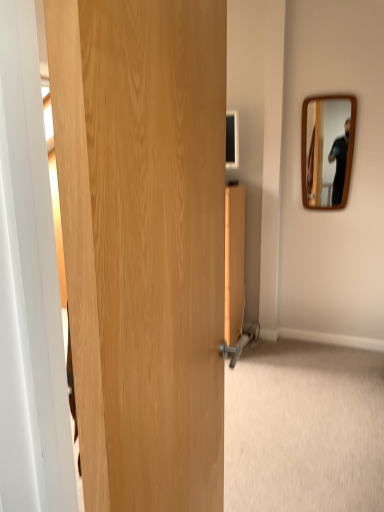
The image size is (384, 512). What do you see at coordinates (327, 150) in the screenshot? I see `wooden mirror at upper right` at bounding box center [327, 150].

The image size is (384, 512). I want to click on wooden mirror at upper right, so click(x=327, y=150).

Find the location of a particular element. natural wood door at center is located at coordinates (143, 243).

Measure the distance between natural wood door at center and camera.

The distance of natural wood door at center from camera is 17.34 inches.

Image resolution: width=384 pixels, height=512 pixels. Describe the element at coordinates (143, 243) in the screenshot. I see `natural wood door at center` at that location.

Where is `wooden mirror at upper right`? wooden mirror at upper right is located at coordinates (327, 150).

Which is more to the right, wooden mirror at upper right or natural wood door at center?

Positioned to the right is wooden mirror at upper right.

In the image, is wooden mirror at upper right positioned in front of or behind natural wood door at center?

Clearly, wooden mirror at upper right is behind natural wood door at center.

Considering the points (323, 202) and (148, 470), which point is in front, point (323, 202) or point (148, 470)?

Positioned in front is point (148, 470).

From the image's perspective, is wooden mirror at upper right located above or below natural wood door at center?

From the image's perspective, wooden mirror at upper right appears above natural wood door at center.

From a real-world perspective, does wooden mirror at upper right sit lower than natural wood door at center?

No, from a real-world perspective, wooden mirror at upper right is not below natural wood door at center.

Between wooden mirror at upper right and natural wood door at center, which one has smaller width?

Thinner between the two is wooden mirror at upper right.

Considering the sizes of objects wooden mirror at upper right and natural wood door at center in the image provided, who is shorter, wooden mirror at upper right or natural wood door at center?

wooden mirror at upper right.

Considering the sizes of objects wooden mirror at upper right and natural wood door at center in the image provided, who is bigger, wooden mirror at upper right or natural wood door at center?

With larger size is natural wood door at center.

Is natural wood door at center surrounded by wooden mirror at upper right?

No, natural wood door at center is not a part of wooden mirror at upper right.

Is wooden mirror at upper right not near natural wood door at center?

Yes, wooden mirror at upper right and natural wood door at center are quite far apart.

Is wooden mirror at upper right oriented away from natural wood door at center?

wooden mirror at upper right is not turned away from natural wood door at center.

The width and height of the screenshot is (384, 512). Identify the location of mirror that appears above the natural wood door at center (from the image's perspective). (327, 150).

Which object is positioned more to the left, natural wood door at center or wooden mirror at upper right?

natural wood door at center.

Is the depth of natural wood door at center greater than that of wooden mirror at upper right?

No, natural wood door at center is closer to the camera.

Is point (115, 28) closer to camera compared to point (302, 149)?

Yes, it is.

From the image's perspective, is natural wood door at center over wooden mirror at upper right?

Actually, natural wood door at center appears below wooden mirror at upper right in the image.

From a real-world perspective, which is physically above, natural wood door at center or wooden mirror at upper right?

wooden mirror at upper right, from a real-world perspective.

Can you confirm if natural wood door at center is wider than wooden mirror at upper right?

Correct, the width of natural wood door at center exceeds that of wooden mirror at upper right.

Between natural wood door at center and wooden mirror at upper right, which one has more height?

natural wood door at center is taller.

Considering the sizes of natural wood door at center and wooden mirror at upper right in the image, is natural wood door at center bigger or smaller than wooden mirror at upper right?

In the image, natural wood door at center appears to be larger than wooden mirror at upper right.

Can wooden mirror at upper right be found inside natural wood door at center?

Definitely not — wooden mirror at upper right is not inside natural wood door at center.

Based on the photo, is natural wood door at center not close to wooden mirror at upper right?

That's right, there is a large distance between natural wood door at center and wooden mirror at upper right.

Is natural wood door at center positioned with its back to wooden mirror at upper right?

No.

Locate an element on the screen. This screenshot has height=512, width=384. door that is on the left side of wooden mirror at upper right is located at coordinates (143, 243).

I want to click on mirror behind the natural wood door at center, so click(x=327, y=150).

Image resolution: width=384 pixels, height=512 pixels. I want to click on door that is in front of the wooden mirror at upper right, so click(x=143, y=243).